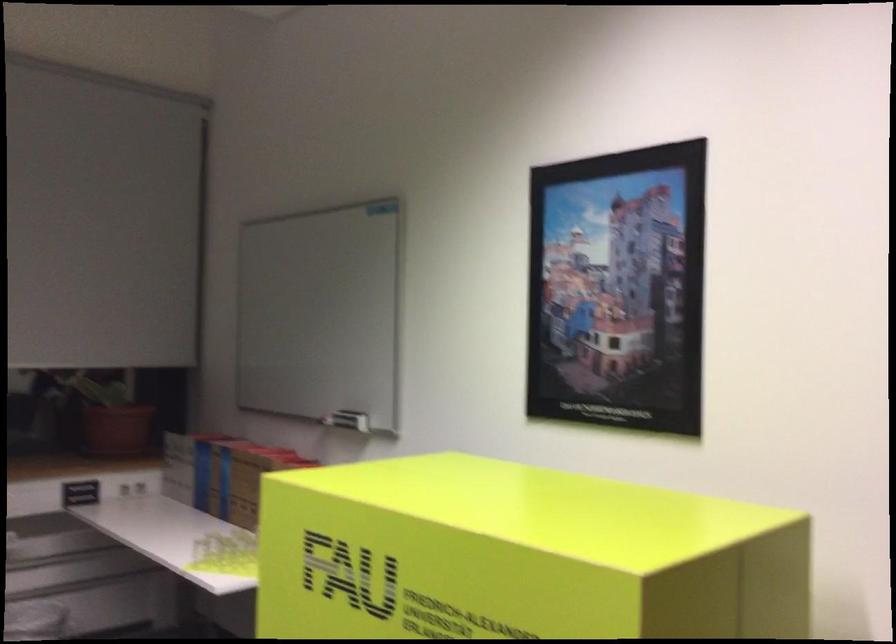
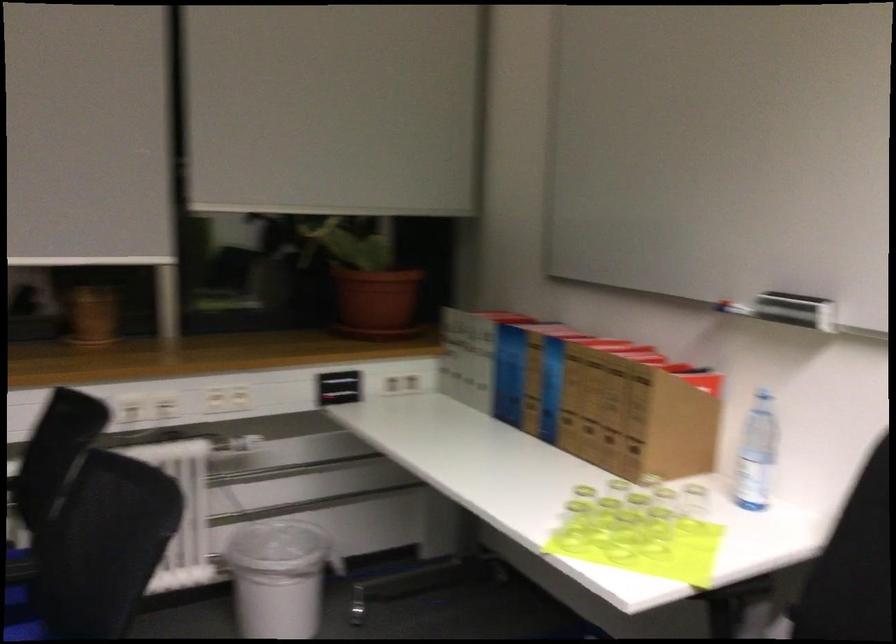
The point at (x=205, y=473) is marked in the first image. Where is the corresponding point in the second image?

(509, 374)